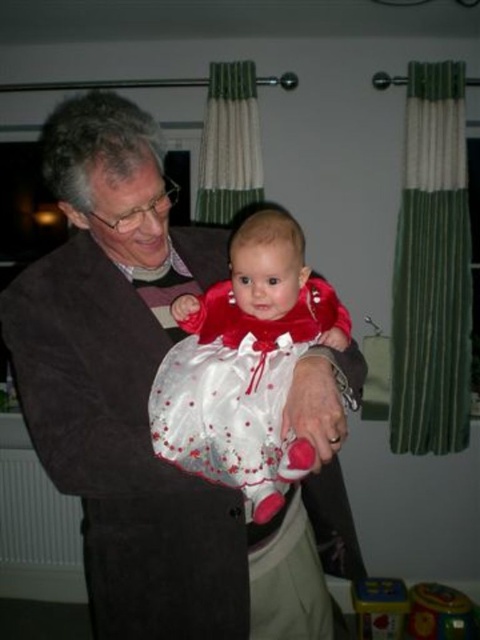
Question: Is suede jacket at center further to camera compared to white satin dress at center?

Choices:
 (A) yes
 (B) no

Answer: (B)

Question: Which point is closer to the camera taking this photo?

Choices:
 (A) (411, 624)
 (B) (240, 509)
 (C) (260, 320)
 (D) (381, 634)

Answer: (C)

Question: Is smooth plastic toy at lower right positioned behind multicolored plastic toy at lower right?

Choices:
 (A) yes
 (B) no

Answer: (A)

Question: Considering the real-world distances, which object is farthest from the suede jacket at center?

Choices:
 (A) multicolored plastic toy at lower right
 (B) white satin dress at center

Answer: (A)

Question: Does suede jacket at center have a lesser width compared to smooth plastic toy at lower right?

Choices:
 (A) yes
 (B) no

Answer: (B)

Question: Which of the following is the closest to the observer?

Choices:
 (A) (210, 364)
 (B) (399, 586)
 (C) (420, 628)

Answer: (A)